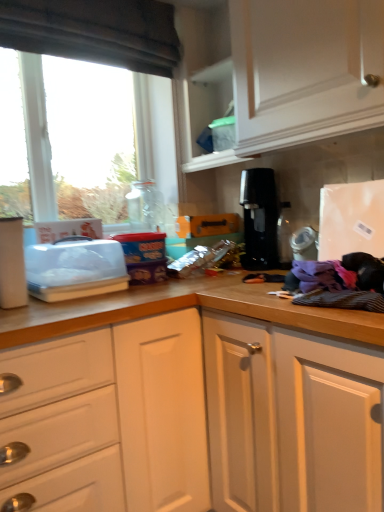
At what (x,y) coordinates should I click in order to perform the action: click on clear plastic container at left. Please return your answer as a coordinate pair (x, y). The width and height of the screenshot is (384, 512). Looking at the image, I should click on (75, 269).

This screenshot has width=384, height=512. What do you see at coordinates (95, 31) in the screenshot? I see `transparent glass window at left` at bounding box center [95, 31].

Where is `clear plastic container at left`? clear plastic container at left is located at coordinates (75, 269).

Considering the points (173, 60) and (160, 55), which point is in front, point (173, 60) or point (160, 55)?

The point (160, 55) is more forward.

Is transparent glass window at left surrounding dark fabric exhaust hood at upper left?

Definitely not — dark fabric exhaust hood at upper left is not inside transparent glass window at left.

How many degrees apart are the facing directions of transparent glass window at left and dark fabric exhaust hood at upper left?

The angular difference between transparent glass window at left and dark fabric exhaust hood at upper left is 0.438 degrees.

Is transparent glass window at left further to camera compared to dark fabric exhaust hood at upper left?

Yes, the depth of transparent glass window at left is greater than that of dark fabric exhaust hood at upper left.

Measure the distance between dark fabric exhaust hood at upper left and black plastic coffee machine at center.

dark fabric exhaust hood at upper left and black plastic coffee machine at center are 31.97 inches apart.

Considering the positions of points (132, 50) and (251, 229), is point (132, 50) farther from camera compared to point (251, 229)?

Yes.

From a real-world perspective, is dark fabric exhaust hood at upper left under black plastic coffee machine at center?

Incorrect, from a real-world perspective, dark fabric exhaust hood at upper left is higher than black plastic coffee machine at center.

Relative to black plastic coffee machine at center, is dark fabric exhaust hood at upper left in front or behind?

Clearly, dark fabric exhaust hood at upper left is in front of black plastic coffee machine at center.

Consider the image. Considering the relative sizes of transparent glass window at left and clear plastic container at left in the image provided, is transparent glass window at left shorter than clear plastic container at left?

No, transparent glass window at left is not shorter than clear plastic container at left.

Locate an element on the screen. window located above the clear plastic container at left (from a real-world perspective) is located at coordinates (x=95, y=31).

Is transparent glass window at left turned away from clear plastic container at left?

transparent glass window at left is not turned away from clear plastic container at left.

From a real-world perspective, is transparent glass window at left under clear plastic container at left?

No, from a real-world perspective, transparent glass window at left is not beneath clear plastic container at left.

Which is closer to the camera, (256, 200) or (127, 42)?

Point (256, 200) is farther from the camera than point (127, 42).

Considering the relative sizes of black plastic coffee machine at center and transparent glass window at left in the image provided, is black plastic coffee machine at center taller than transparent glass window at left?

Incorrect, the height of black plastic coffee machine at center is not larger of that of transparent glass window at left.

Is black plastic coffee machine at center facing away from transparent glass window at left?

No.

Who is smaller, black plastic coffee machine at center or clear plastic container at left?

Smaller between the two is black plastic coffee machine at center.

Is black plastic coffee machine at center further to the viewer compared to clear plastic container at left?

That is True.

From the picture: From a real-world perspective, which is physically below, black plastic coffee machine at center or clear plastic container at left?

In real-world perspective, clear plastic container at left is lower.

Which of these two, black plastic coffee machine at center or clear plastic container at left, is thinner?

Thinner between the two is black plastic coffee machine at center.

Is dark fabric exhaust hood at upper left not near transparent glass window at left?

dark fabric exhaust hood at upper left is actually quite close to transparent glass window at left.

From a real-world perspective, which is physically above, dark fabric exhaust hood at upper left or transparent glass window at left?

In real-world perspective, dark fabric exhaust hood at upper left is above.

From the image's perspective, is dark fabric exhaust hood at upper left on top of transparent glass window at left?

Indeed, from the image's perspective, dark fabric exhaust hood at upper left is shown above transparent glass window at left.

Identify the location of exhaust hood on the right side of transparent glass window at left. 95,32.

From the image's perspective, which is below, clear plastic container at left or transparent glass window at left?

clear plastic container at left appears lower in the image.

Which is closer, (98,273) or (30,49)?

Point (98,273) is positioned closer to the camera compared to point (30,49).

In the scene shown: Is clear plastic container at left not near transparent glass window at left?

No, clear plastic container at left is not far away from transparent glass window at left.

Locate an element on the screen. The height and width of the screenshot is (512, 384). exhaust hood that is above the transparent glass window at left (from a real-world perspective) is located at coordinates (95, 32).

Where is `coffee machine below the dark fabric exhaust hood at upper left (from a real-world perspective)`? coffee machine below the dark fabric exhaust hood at upper left (from a real-world perspective) is located at coordinates (259, 219).

Looking at the image, which one is located further to transparent glass window at left, clear plastic container at left or dark fabric exhaust hood at upper left?

The object further to transparent glass window at left is clear plastic container at left.

From the image, which object appears to be farther from transparent glass window at left, black plastic coffee machine at center or dark fabric exhaust hood at upper left?

Result: Among the two, black plastic coffee machine at center is located further to transparent glass window at left.

Considering their positions, is black plastic coffee machine at center positioned closer to clear plastic container at left than dark fabric exhaust hood at upper left?

black plastic coffee machine at center is closer to clear plastic container at left.

Based on their spatial positions, is dark fabric exhaust hood at upper left or transparent glass window at left closer to black plastic coffee machine at center?

transparent glass window at left lies closer to black plastic coffee machine at center than the other object.

Looking at the image, which one is located further to dark fabric exhaust hood at upper left, transparent glass window at left or black plastic coffee machine at center?

Based on the image, black plastic coffee machine at center appears to be further to dark fabric exhaust hood at upper left.

From the image, which object appears to be nearer to transparent glass window at left, black plastic coffee machine at center or clear plastic container at left?

black plastic coffee machine at center is closer to transparent glass window at left.

Considering their positions, is transparent glass window at left positioned closer to clear plastic container at left than black plastic coffee machine at center?

The object closer to clear plastic container at left is black plastic coffee machine at center.

From the image, which object appears to be farther from black plastic coffee machine at center, dark fabric exhaust hood at upper left or clear plastic container at left?

dark fabric exhaust hood at upper left is positioned further to the anchor black plastic coffee machine at center.

Find the location of a particular element. The width and height of the screenshot is (384, 512). window that lies between dark fabric exhaust hood at upper left and clear plastic container at left from top to bottom is located at coordinates (95, 31).

Find the location of a particular element. Image resolution: width=384 pixels, height=512 pixels. exhaust hood located between transparent glass window at left and black plastic coffee machine at center in the left-right direction is located at coordinates (95, 32).

Identify the location of appliance between transparent glass window at left and black plastic coffee machine at center from left to right. The height and width of the screenshot is (512, 384). (75, 269).

Locate an element on the screen. Image resolution: width=384 pixels, height=512 pixels. coffee machine that lies between dark fabric exhaust hood at upper left and clear plastic container at left from top to bottom is located at coordinates (259, 219).